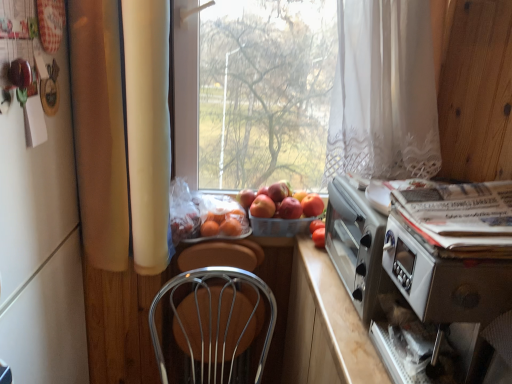
Question: Does point (257, 200) appear closer or farther from the camera than point (280, 205)?

Choices:
 (A) closer
 (B) farther

Answer: (B)

Question: In the image, is red matte apple at center, the 4th apple in the right-to-left sequence, on the left side or the right side of red matte apple at center, arranged as the 3th apple when viewed from the left?

Choices:
 (A) left
 (B) right

Answer: (A)

Question: Estimate the real-world distances between objects in this image. Which object is closer to the white glossy magazine at right?

Choices:
 (A) red matte apple at center, the 2th apple viewed from the left
 (B) red matte apple at center, the fourth apple in the left-to-right sequence
 (C) red matte tomato at lower right, the first fruit in the right-to-left sequence
 (D) orange matte at center, placed as the 2th fruit when sorted from right to left
 (E) red matte apple at center, positioned as the 1th apple in left-to-right order

Answer: (C)

Question: Which object is the farthest from the white glossy fridge at left?

Choices:
 (A) red matte apple at center, the 4th apple in the right-to-left sequence
 (B) red matte apple at center, the fourth apple in the left-to-right sequence
 (C) metallic wire chair at center
 (D) metallic silver toaster at right
 (E) red matte tomato at lower right, placed as the second fruit when sorted from left to right

Answer: (B)